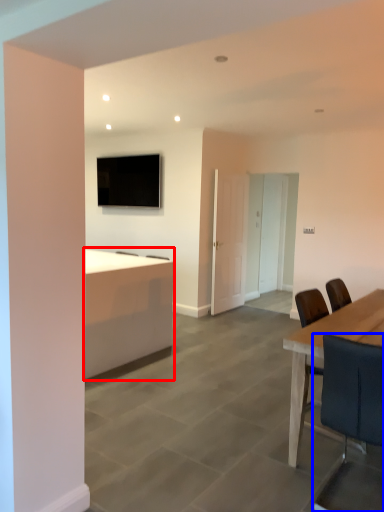
Question: Among these objects, which one is farthest to the camera, desk (highlighted by a red box) or chair (highlighted by a blue box)?

Choices:
 (A) desk
 (B) chair

Answer: (A)